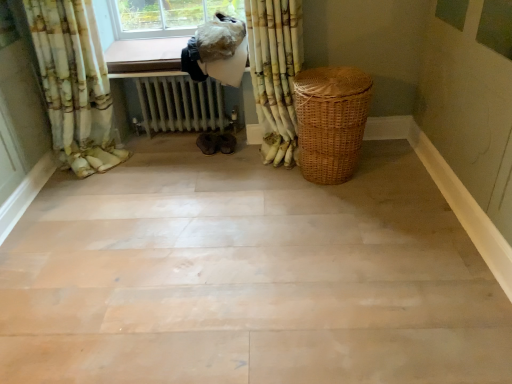
Locate an element on the screen. vacant area in front of white textured curtain at upper right, placed as the 1th curtain when sorted from right to left is located at coordinates (263, 185).